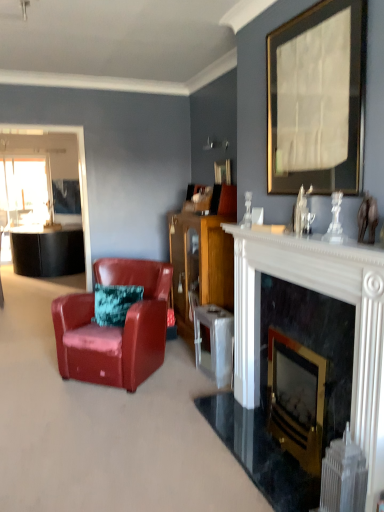
The height and width of the screenshot is (512, 384). Identify the location of free space in front of metallic silver table at center. (206, 390).